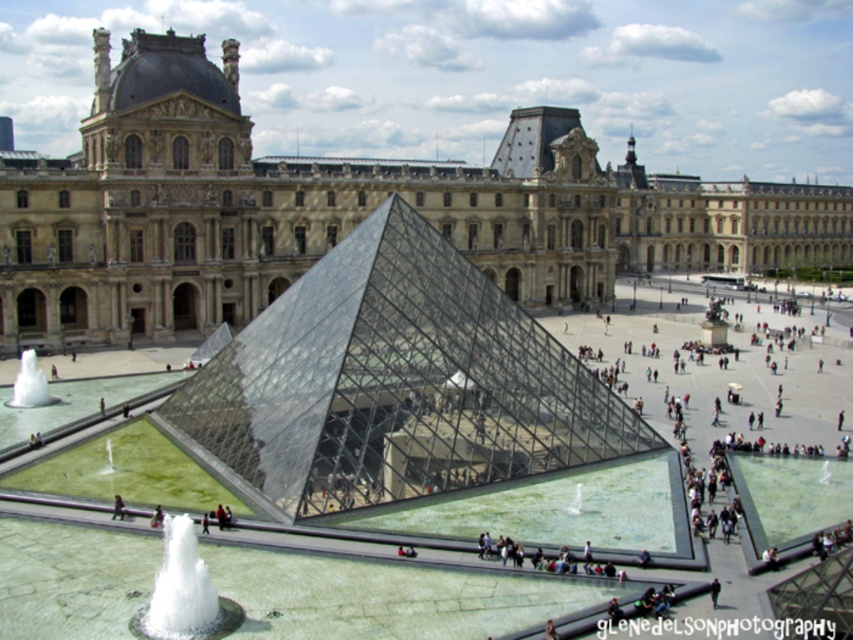
Is transparent glass pyramid at center taller than dark blue fabric at center?

Indeed, transparent glass pyramid at center has a greater height compared to dark blue fabric at center.

Who is higher up, transparent glass pyramid at center or dark blue fabric at center?

Positioned higher is transparent glass pyramid at center.

This screenshot has height=640, width=853. Identify the location of transparent glass pyramid at center. (396, 384).

The height and width of the screenshot is (640, 853). What do you see at coordinates (341, 209) in the screenshot? I see `beige stone palace at center` at bounding box center [341, 209].

Image resolution: width=853 pixels, height=640 pixels. I want to click on beige stone palace at center, so click(341, 209).

Does transparent glass pyramid at center have a lesser height compared to white frothy water at lower left?

No, transparent glass pyramid at center is not shorter than white frothy water at lower left.

Can you confirm if transparent glass pyramid at center is wider than white frothy water at lower left?

Yes, transparent glass pyramid at center is wider than white frothy water at lower left.

Is point (419, 358) positioned behind point (169, 595)?

Yes, it is behind point (169, 595).

Where is `transparent glass pyramid at center`? transparent glass pyramid at center is located at coordinates pos(396,384).